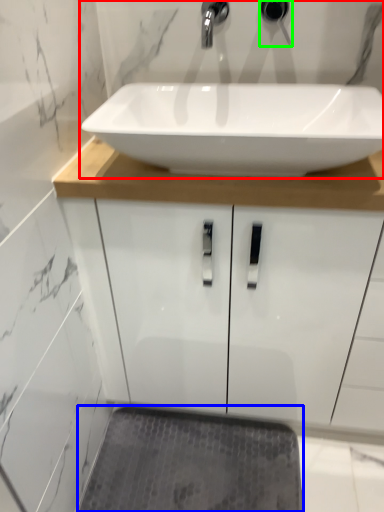
Question: Which is farther away from sink (highlighted by a red box)? bath mat (highlighted by a blue box) or plumbing fixture (highlighted by a green box)?

Choices:
 (A) bath mat
 (B) plumbing fixture

Answer: (A)